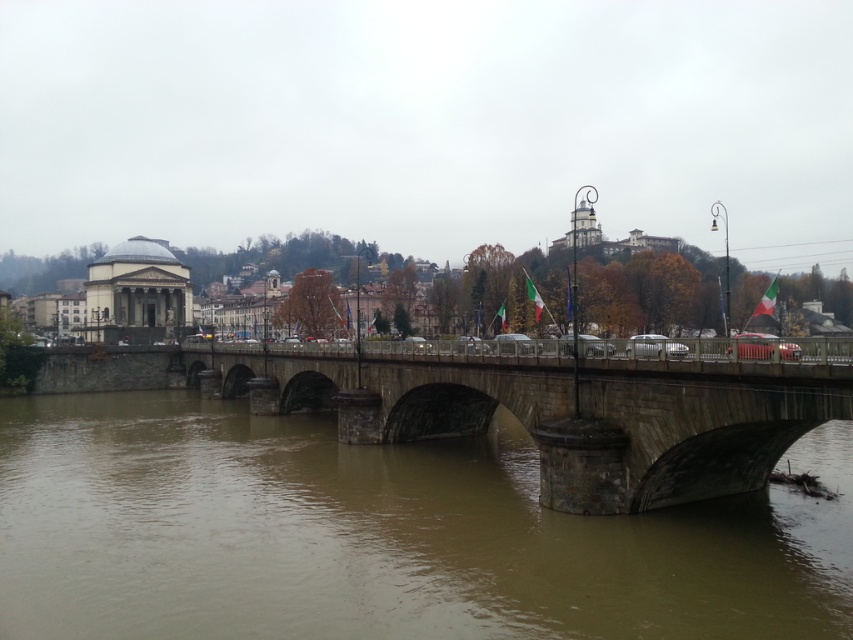
You are a tourist standing on the stone bridge at center and looking towards the brown stone river at center. Which object is closer to you?

The brown stone river at center is closer to you because it is positioned in front of the stone bridge at center.

You are an architect analyzing the urban landscape. You need to determine which structure has a greater height between the brown stone river at center and the stone bridge at center. Based on the scene, which one is taller?

The stone bridge at center is taller than the brown stone river at center, as the bridge spans over the river, indicating it is elevated higher.